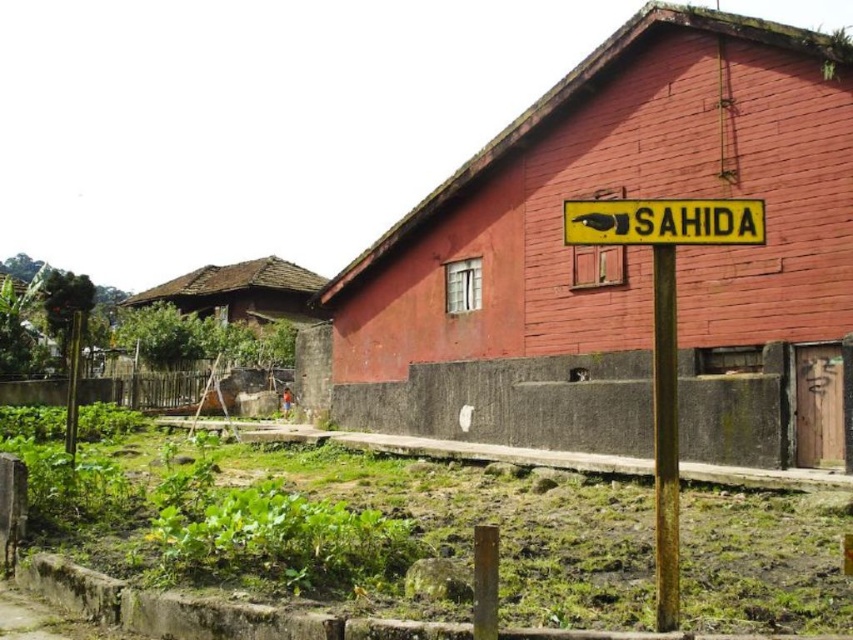
You are a farmer checking the field between the yellow metal sign at center and the rusty metal pole at right. Which object is positioned lower in the scene?

The yellow metal sign at center is located below the rusty metal pole at right, so it is positioned lower in the scene.

You are a farmer standing in the field in front of the smooth red wooden hut at center and the yellow plastic sign at upper center. You need to hang a new sign that is 1.2 meters tall. Which object can you place the new sign next to without it being taller than that object?

The smooth red wooden hut at center is much taller than the yellow plastic sign at upper center. Therefore, the new sign can be placed next to the smooth red wooden hut at center since it is taller than 1.2 meters, ensuring the new sign won not exceed its height.